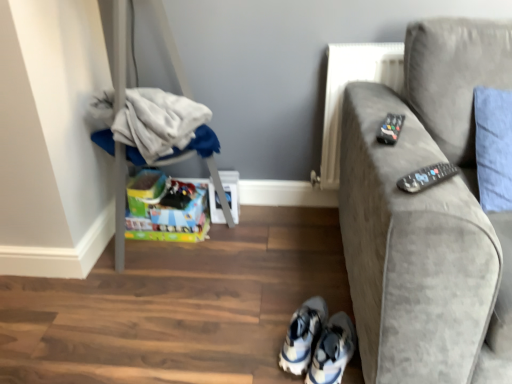
Describe the element at coordinates (333, 351) in the screenshot. I see `white synthetic sneakers at lower center, the 2th footwear when ordered from left to right` at that location.

Locate an element on the screen. black plastic remote at upper right, the first remote in the top-to-bottom sequence is located at coordinates (390, 128).

This screenshot has width=512, height=384. What are the coordinates of `white fabric at left` in the screenshot? It's located at (159, 127).

In order to face velvet gray couch at right, should I rotate leftwards or rightwards?

Rotate right and turn 28.007 degrees.

The height and width of the screenshot is (384, 512). What do you see at coordinates (423, 210) in the screenshot?
I see `velvet gray couch at right` at bounding box center [423, 210].

Find the location of `white synthetic sneakers at lower center, the 2th footwear when ordered from left to right`. white synthetic sneakers at lower center, the 2th footwear when ordered from left to right is located at coordinates (333, 351).

Which object is further away from the camera, velvet gray couch at right or white synthetic sneakers at lower center, the 2th footwear when ordered from left to right?

white synthetic sneakers at lower center, the 2th footwear when ordered from left to right.

I want to click on studio couch above the white synthetic sneakers at lower center, which ranks as the 1th footwear in right-to-left order (from the image's perspective), so click(x=423, y=210).

Considering the sizes of velvet gray couch at right and white synthetic sneakers at lower center, which ranks as the 1th footwear in right-to-left order, in the image, is velvet gray couch at right wider or thinner than white synthetic sneakers at lower center, which ranks as the 1th footwear in right-to-left order,?

In the image, velvet gray couch at right appears to be wider than white synthetic sneakers at lower center, which ranks as the 1th footwear in right-to-left order.

Between velvet gray couch at right and white synthetic sneakers at lower center, the 2th footwear when ordered from left to right, which one appears on the left side from the viewer's perspective?

white synthetic sneakers at lower center, the 2th footwear when ordered from left to right, is more to the left.

Can you confirm if black plastic remote at upper right, the first remote in the top-to-bottom sequence, is smaller than white synthetic sneakers at lower center, which ranks as the 1th footwear in right-to-left order?

Indeed, black plastic remote at upper right, the first remote in the top-to-bottom sequence, has a smaller size compared to white synthetic sneakers at lower center, which ranks as the 1th footwear in right-to-left order.

Looking at their sizes, would you say black plastic remote at upper right, the 1th remote when ordered from back to front, is wider or thinner than white synthetic sneakers at lower center, which ranks as the 1th footwear in right-to-left order?

black plastic remote at upper right, the 1th remote when ordered from back to front, is thinner than white synthetic sneakers at lower center, which ranks as the 1th footwear in right-to-left order.

Which is more distant, (381,128) or (318,344)?

Positioned behind is point (318,344).

Which object is positioned more to the right, black plastic remote at upper right, which appears as the 2th remote when viewed from the front, or white synthetic sneakers at lower center, the 2th footwear when ordered from left to right?

From the viewer's perspective, black plastic remote at upper right, which appears as the 2th remote when viewed from the front, appears more on the right side.

Which of these two, white fabric at left or black plastic remote at upper right, which appears as the 2th remote when viewed from the front, is wider?

With larger width is white fabric at left.

Could you tell me if white fabric at left is turned towards black plastic remote at upper right, which appears as the 2th remote when viewed from the front?

No, white fabric at left is not turned towards black plastic remote at upper right, which appears as the 2th remote when viewed from the front.

From their relative heights in the image, would you say white fabric at left is taller or shorter than black plastic remote at upper right, the first remote in the top-to-bottom sequence?

In the image, white fabric at left appears to be taller than black plastic remote at upper right, the first remote in the top-to-bottom sequence.

From the image's perspective, is white fabric at left above or below black plastic remote at upper right, the first remote in the top-to-bottom sequence?

Based on their image positions, white fabric at left is located above black plastic remote at upper right, the first remote in the top-to-bottom sequence.

Is black plastic remote at right, which is the 1th remote from front to back, not within white synthetic sneakers at lower center, the 2th footwear when ordered from left to right?

Indeed, black plastic remote at right, which is the 1th remote from front to back, is completely outside white synthetic sneakers at lower center, the 2th footwear when ordered from left to right.

In the scene shown: Is black plastic remote at right, which is the 2th remote from back to front, positioned with its back to white synthetic sneakers at lower center, which ranks as the 1th footwear in right-to-left order?

black plastic remote at right, which is the 2th remote from back to front, does not have its back to white synthetic sneakers at lower center, which ranks as the 1th footwear in right-to-left order.

From the image's perspective, is black plastic remote at right, which is the 2th remote from back to front, located beneath white synthetic sneakers at lower center, which ranks as the 1th footwear in right-to-left order?

No, from the image's perspective, black plastic remote at right, which is the 2th remote from back to front, is not below white synthetic sneakers at lower center, which ranks as the 1th footwear in right-to-left order.

At what (x,y) coordinates should I click in order to perform the action: click on the 1st footwear to the left of the black plastic remote at right, arranged as the 1th remote when ordered from the bottom, counting from the anchor's position. Please return your answer as a coordinate pair (x, y). The height and width of the screenshot is (384, 512). Looking at the image, I should click on (333, 351).

You are a GUI agent. You are given a task and a screenshot of the screen. Output one action in this format:
    pyautogui.click(x=<x>, y=<y>)
    Task: Click on the studio couch that appears on the right of white mesh sneakers at lower center, the first footwear from the left
    The width and height of the screenshot is (512, 384).
    Given the screenshot: What is the action you would take?
    pyautogui.click(x=423, y=210)

Does white mesh sneakers at lower center, the first footwear from the left, have a lesser height compared to velvet gray couch at right?

Yes, white mesh sneakers at lower center, the first footwear from the left, is shorter than velvet gray couch at right.

Is there a large distance between white mesh sneakers at lower center, which is counted as the 2th footwear, starting from the right, and velvet gray couch at right?

No, white mesh sneakers at lower center, which is counted as the 2th footwear, starting from the right, is not far from velvet gray couch at right.

Which object is positioned more to the left, white synthetic sneakers at lower center, the 2th footwear when ordered from left to right, or black plastic remote at right, which is the 2th remote from back to front?

white synthetic sneakers at lower center, the 2th footwear when ordered from left to right.

From a real-world perspective, between white synthetic sneakers at lower center, which ranks as the 1th footwear in right-to-left order, and black plastic remote at right, the second remote from the top, who is vertically lower?

white synthetic sneakers at lower center, which ranks as the 1th footwear in right-to-left order.

Is the surface of white synthetic sneakers at lower center, which ranks as the 1th footwear in right-to-left order, in direct contact with black plastic remote at right, arranged as the 1th remote when ordered from the bottom?

They are not placed beside each other.

Which point is more forward, (312, 359) or (416, 187)?

The point (416, 187) is closer.

Between black plastic remote at upper right, the second remote when ordered from bottom to top, and black plastic remote at right, which is the 1th remote from front to back, which one appears on the left side from the viewer's perspective?

black plastic remote at upper right, the second remote when ordered from bottom to top, is more to the left.

Is point (399, 116) positioned in front of point (448, 166)?

No, it is behind (448, 166).

Is black plastic remote at upper right, the second remote when ordered from bottom to top, looking in the opposite direction of black plastic remote at right, arranged as the 1th remote when ordered from the bottom?

black plastic remote at upper right, the second remote when ordered from bottom to top, is not turned away from black plastic remote at right, arranged as the 1th remote when ordered from the bottom.

Relative to black plastic remote at right, arranged as the 1th remote when ordered from the bottom, is black plastic remote at upper right, which appears as the 2th remote when viewed from the front, in front or behind?

black plastic remote at upper right, which appears as the 2th remote when viewed from the front, is behind black plastic remote at right, arranged as the 1th remote when ordered from the bottom.

Where is `studio couch in front of the white synthetic sneakers at lower center, the 2th footwear when ordered from left to right`? The width and height of the screenshot is (512, 384). studio couch in front of the white synthetic sneakers at lower center, the 2th footwear when ordered from left to right is located at coordinates (423, 210).

Where is `remote that is the 2nd object located above the white synthetic sneakers at lower center, which ranks as the 1th footwear in right-to-left order (from the image's perspective)`? The image size is (512, 384). remote that is the 2nd object located above the white synthetic sneakers at lower center, which ranks as the 1th footwear in right-to-left order (from the image's perspective) is located at coordinates (390, 128).

Looking at the image, which one is located further to velvet gray couch at right, black plastic remote at upper right, the 1th remote when ordered from back to front, or white synthetic sneakers at lower center, which ranks as the 1th footwear in right-to-left order?

white synthetic sneakers at lower center, which ranks as the 1th footwear in right-to-left order, lies further to velvet gray couch at right than the other object.

Based on their spatial positions, is black plastic remote at upper right, the second remote when ordered from bottom to top, or white synthetic sneakers at lower center, the 2th footwear when ordered from left to right, closer to black plastic remote at right, which is the 2th remote from back to front?

The object closer to black plastic remote at right, which is the 2th remote from back to front, is black plastic remote at upper right, the second remote when ordered from bottom to top.

Considering their positions, is white fabric at left positioned further to white synthetic sneakers at lower center, the 2th footwear when ordered from left to right, than black plastic remote at upper right, the second remote when ordered from bottom to top?

The object further to white synthetic sneakers at lower center, the 2th footwear when ordered from left to right, is white fabric at left.

From the picture: Considering their positions, is black plastic remote at upper right, the first remote in the top-to-bottom sequence, positioned further to white fabric at left than white mesh sneakers at lower center, which is counted as the 2th footwear, starting from the right?

white mesh sneakers at lower center, which is counted as the 2th footwear, starting from the right, lies further to white fabric at left than the other object.

From the image, which object appears to be nearer to velvet gray couch at right, white synthetic sneakers at lower center, the 2th footwear when ordered from left to right, or white fabric at left?

white synthetic sneakers at lower center, the 2th footwear when ordered from left to right, lies closer to velvet gray couch at right than the other object.

Looking at this image, based on their spatial positions, is white mesh sneakers at lower center, which is counted as the 2th footwear, starting from the right, or white fabric at left further from black plastic remote at right, the second remote from the top?

Based on the image, white fabric at left appears to be further to black plastic remote at right, the second remote from the top.

From the picture: Looking at the image, which one is located further to velvet gray couch at right, white synthetic sneakers at lower center, which ranks as the 1th footwear in right-to-left order, or white mesh sneakers at lower center, which is counted as the 2th footwear, starting from the right?

Based on the image, white mesh sneakers at lower center, which is counted as the 2th footwear, starting from the right, appears to be further to velvet gray couch at right.

In the scene shown: When comparing their distances from white mesh sneakers at lower center, which is counted as the 2th footwear, starting from the right, does black plastic remote at right, which is the 1th remote from front to back, or white synthetic sneakers at lower center, which ranks as the 1th footwear in right-to-left order, seem further?

black plastic remote at right, which is the 1th remote from front to back.

This screenshot has width=512, height=384. I want to click on remote between black plastic remote at upper right, the first remote in the top-to-bottom sequence, and white synthetic sneakers at lower center, the 2th footwear when ordered from left to right, from top to bottom, so click(x=426, y=177).

Find the location of a particular element. Image resolution: width=512 pixels, height=384 pixels. remote between velvet gray couch at right and black plastic remote at upper right, the 1th remote when ordered from back to front, in the front-back direction is located at coordinates (426, 177).

You are a GUI agent. You are given a task and a screenshot of the screen. Output one action in this format:
    pyautogui.click(x=<x>, y=<y>)
    Task: Click on the footwear that lies between black plastic remote at right, which is the 1th remote from front to back, and white synthetic sneakers at lower center, the 2th footwear when ordered from left to right, from top to bottom
    This screenshot has width=512, height=384.
    Given the screenshot: What is the action you would take?
    pyautogui.click(x=303, y=335)

At what (x,y) coordinates should I click in order to perform the action: click on remote situated between white fabric at left and black plastic remote at right, which is the 1th remote from front to back, from left to right. Please return your answer as a coordinate pair (x, y). Looking at the image, I should click on 390,128.